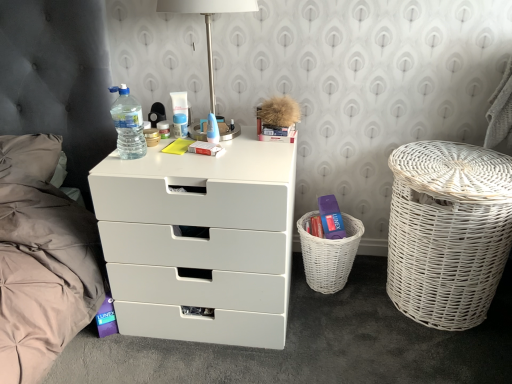
The height and width of the screenshot is (384, 512). Find the location of `vacant space to the right of white wicker basket at lower right`. vacant space to the right of white wicker basket at lower right is located at coordinates (374, 281).